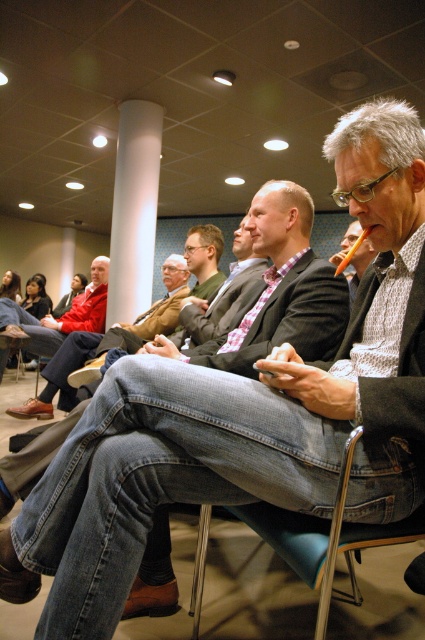
You are a tailor trying to determine which item to place on a narrow table. Given the denim jeans at center and the matte black jacket at center, which one has a greater width?

The denim jeans at center has a greater width than the matte black jacket at center according to the description.

From the picture: You are attending a meeting in this conference room and need to sit down. There is a metallic blue chair at lower center and a red jacket at center. Which object is closer to the floor?

The metallic blue chair at lower center is closer to the floor since it is below the red jacket at center.

In the scene shown: You are organizing a charity event and need to decide which jacket to donate between the red jacket at center and the matte black jacket at center. If you want to donate the larger one, which jacket should you choose?

The red jacket at center is larger than the matte black jacket at center, so you should choose the red jacket at center for donation.